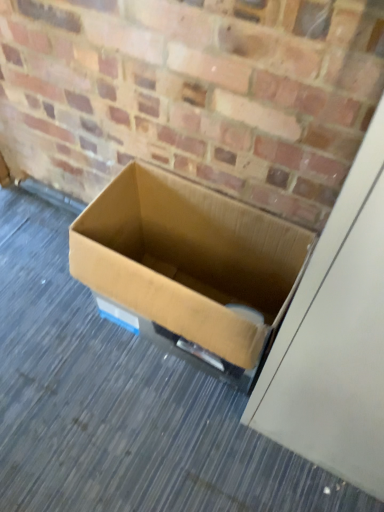
Question: Does brown cardboard box at center have a lesser width compared to brown cardboard box at center?

Choices:
 (A) yes
 (B) no

Answer: (A)

Question: From a real-world perspective, is brown cardboard box at center physically below brown cardboard box at center?

Choices:
 (A) yes
 (B) no

Answer: (B)

Question: Is brown cardboard box at center at the back of brown cardboard box at center?

Choices:
 (A) yes
 (B) no

Answer: (B)

Question: From the image's perspective, is brown cardboard box at center located beneath brown cardboard box at center?

Choices:
 (A) yes
 (B) no

Answer: (B)

Question: Is brown cardboard box at center located within brown cardboard box at center?

Choices:
 (A) yes
 (B) no

Answer: (B)

Question: Is brown cardboard box at center not near brown cardboard box at center?

Choices:
 (A) no
 (B) yes

Answer: (A)

Question: Considering the relative sizes of brown cardboard box at center and brown cardboard box at center in the image provided, is brown cardboard box at center shorter than brown cardboard box at center?

Choices:
 (A) no
 (B) yes

Answer: (B)

Question: From a real-world perspective, is brown cardboard box at center under brown cardboard box at center?

Choices:
 (A) no
 (B) yes

Answer: (B)

Question: Is brown cardboard box at center positioned before brown cardboard box at center?

Choices:
 (A) no
 (B) yes

Answer: (A)

Question: Could brown cardboard box at center be considered to be inside brown cardboard box at center?

Choices:
 (A) yes
 (B) no

Answer: (B)

Question: Does brown cardboard box at center appear on the left side of brown cardboard box at center?

Choices:
 (A) no
 (B) yes

Answer: (B)

Question: Considering the relative sizes of brown cardboard box at center and brown cardboard box at center in the image provided, is brown cardboard box at center bigger than brown cardboard box at center?

Choices:
 (A) no
 (B) yes

Answer: (A)

Question: Looking at their shapes, would you say brown cardboard box at center is wider or thinner than brown cardboard box at center?

Choices:
 (A) thin
 (B) wide

Answer: (B)